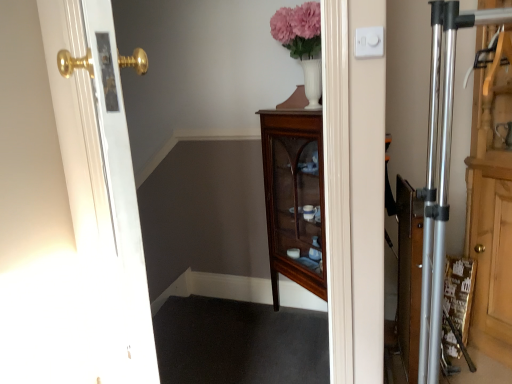
Identify the location of vacant area that lies in front of mahogany glass-front cabinet at center. Image resolution: width=512 pixels, height=384 pixels. (278, 368).